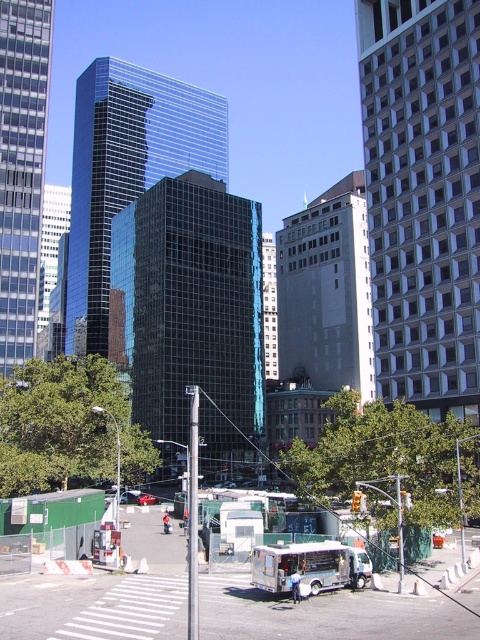
You are a pedestrian standing at the crosswalk in the foreground. You see a white metallic food truck at center and a metallic red car at center. Which one is closer to your right side?

The white metallic food truck at center is to the right of the metallic red car at center, so the white metallic food truck at center is closer to your right side.